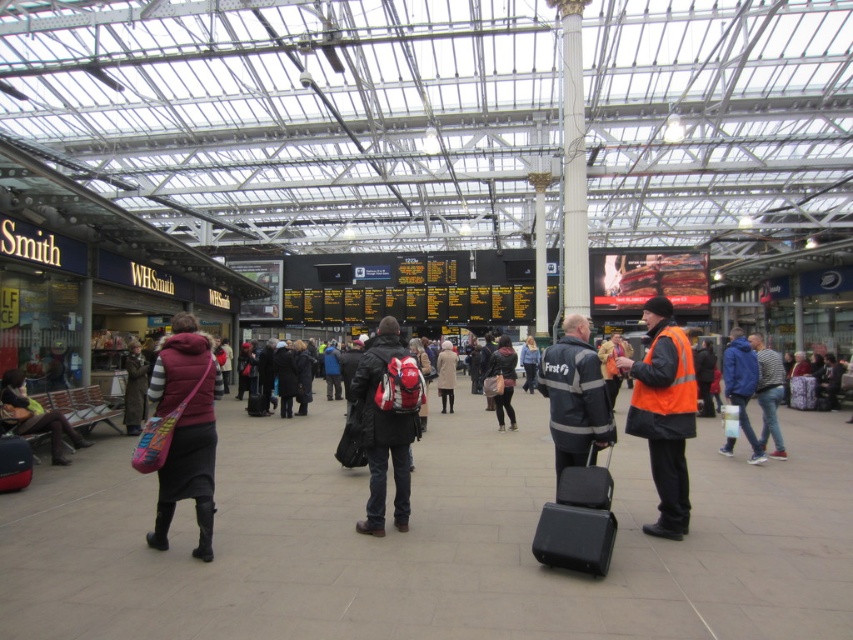
Question: Among these points, which one is nearest to the camera?

Choices:
 (A) (439, 394)
 (B) (657, 531)
 (C) (202, 513)

Answer: (C)

Question: Does matte black backpack at center have a greater width compared to black hard suitcase at lower center?

Choices:
 (A) yes
 (B) no

Answer: (B)

Question: Among these points, which one is nearest to the camera?

Choices:
 (A) (450, 348)
 (B) (746, 365)

Answer: (B)

Question: Which object appears farthest from the camera in this image?

Choices:
 (A) black hard suitcase at center
 (B) matte black backpack at center
 (C) blue denim jacket at center
 (D) light beige coat at center

Answer: (C)

Question: Is matte black backpack at center to the left of matte black jacket at lower left from the viewer's perspective?

Choices:
 (A) no
 (B) yes

Answer: (A)

Question: Considering the relative positions of light beige coat at center and black hard suitcase at center in the image provided, where is light beige coat at center located with respect to black hard suitcase at center?

Choices:
 (A) left
 (B) right

Answer: (B)